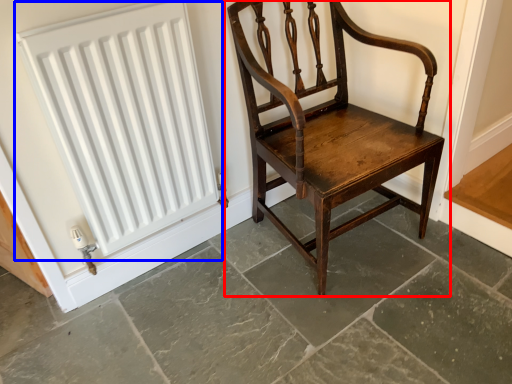
Question: Which object appears farthest to the camera in this image, chair (highlighted by a red box) or radiator (highlighted by a blue box)?

Choices:
 (A) chair
 (B) radiator

Answer: (B)